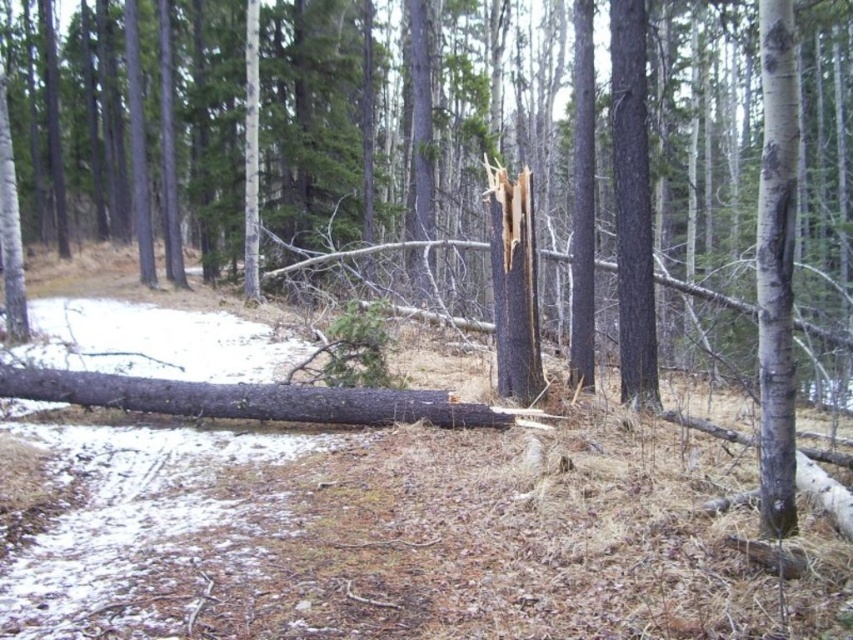
Question: Is white bark tree trunk at right below dark gray bark log at center?

Choices:
 (A) no
 (B) yes

Answer: (A)

Question: Which object appears farthest from the camera in this image?

Choices:
 (A) white bark tree trunk at right
 (B) dark gray bark log at center

Answer: (B)

Question: Which point is closer to the camera taking this photo?

Choices:
 (A) pyautogui.click(x=764, y=8)
 (B) pyautogui.click(x=315, y=420)

Answer: (A)

Question: Can you confirm if white bark tree trunk at right is smaller than dark gray bark log at center?

Choices:
 (A) no
 (B) yes

Answer: (A)

Question: Does white bark tree trunk at right lie behind dark gray bark log at center?

Choices:
 (A) no
 (B) yes

Answer: (A)

Question: Which of the following is the closest to the observer?

Choices:
 (A) dark gray bark log at center
 (B) white bark tree trunk at right

Answer: (B)